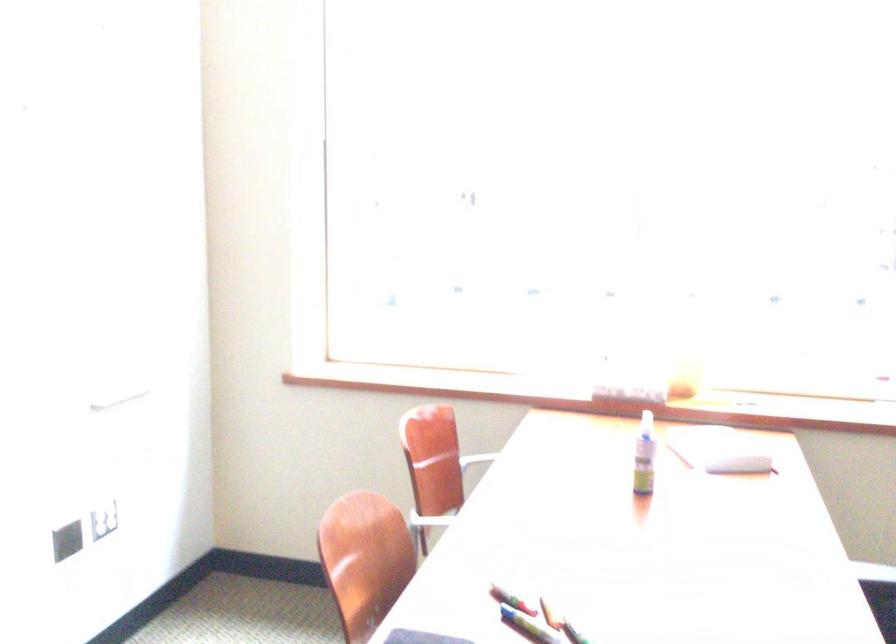
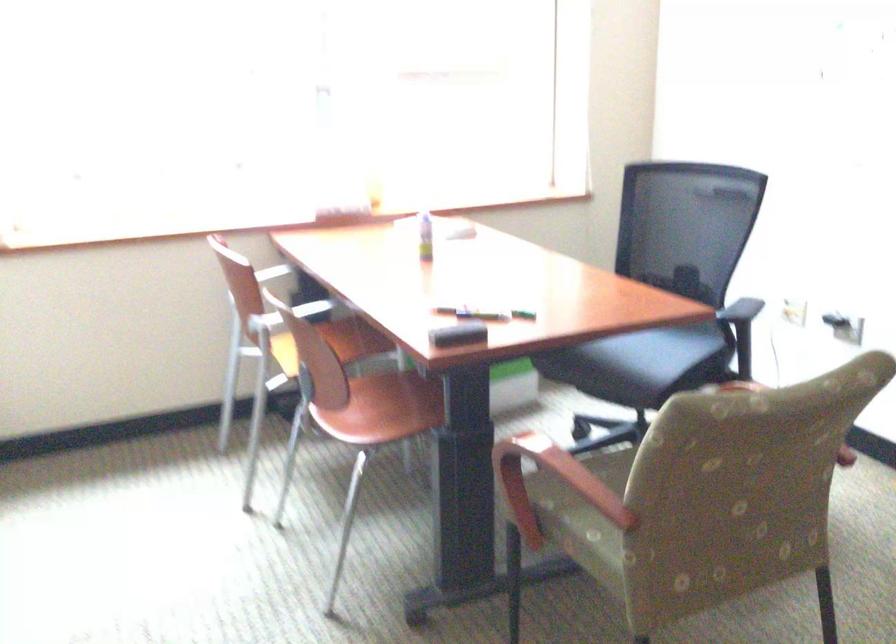
The point at (618, 402) is marked in the first image. Where is the corresponding point in the second image?

(346, 214)